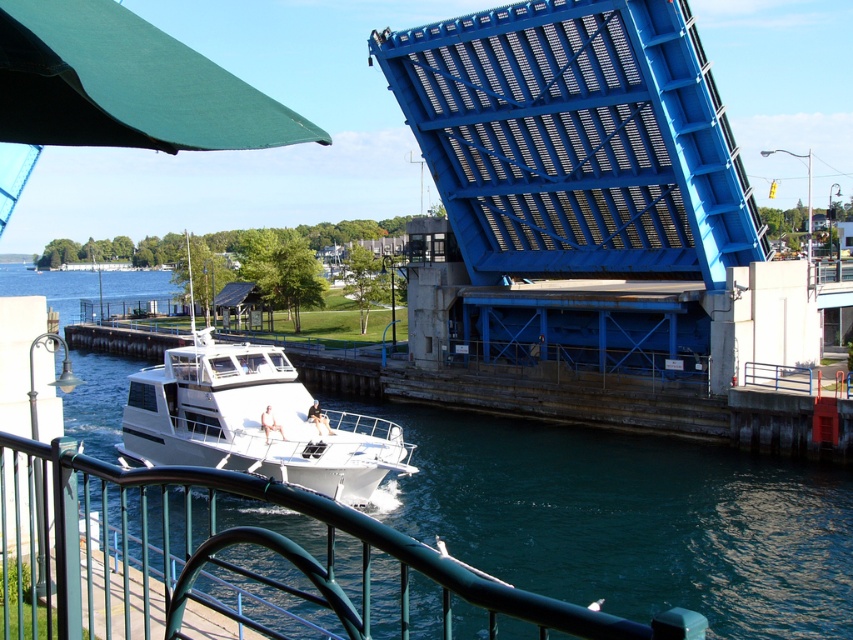
Is metallic green railing at lower center to the right of white glossy boat at center from the viewer's perspective?

Yes, metallic green railing at lower center is to the right of white glossy boat at center.

Find the location of a particular element. The image size is (853, 640). metallic green railing at lower center is located at coordinates (225, 560).

Which is behind, point (432, 444) or point (167, 401)?

Point (432, 444)

Does blue metallic water at lower center appear on the right side of white glossy boat at center?

In fact, blue metallic water at lower center is to the left of white glossy boat at center.

Is point (506, 513) more distant than point (235, 435)?

Yes, point (506, 513) is behind point (235, 435).

Identify the location of blue metallic water at lower center. The height and width of the screenshot is (640, 853). point(630,518).

Between point (619, 445) and point (1, 452), which one is positioned in front?

Positioned in front is point (1, 452).

Between blue metallic water at lower center and metallic green railing at lower center, which one appears on the left side from the viewer's perspective?

From the viewer's perspective, blue metallic water at lower center appears more on the left side.

Identify the location of blue metallic water at lower center. Image resolution: width=853 pixels, height=640 pixels. (630, 518).

Where is `blue metallic water at lower center`? This screenshot has width=853, height=640. blue metallic water at lower center is located at coordinates (630, 518).